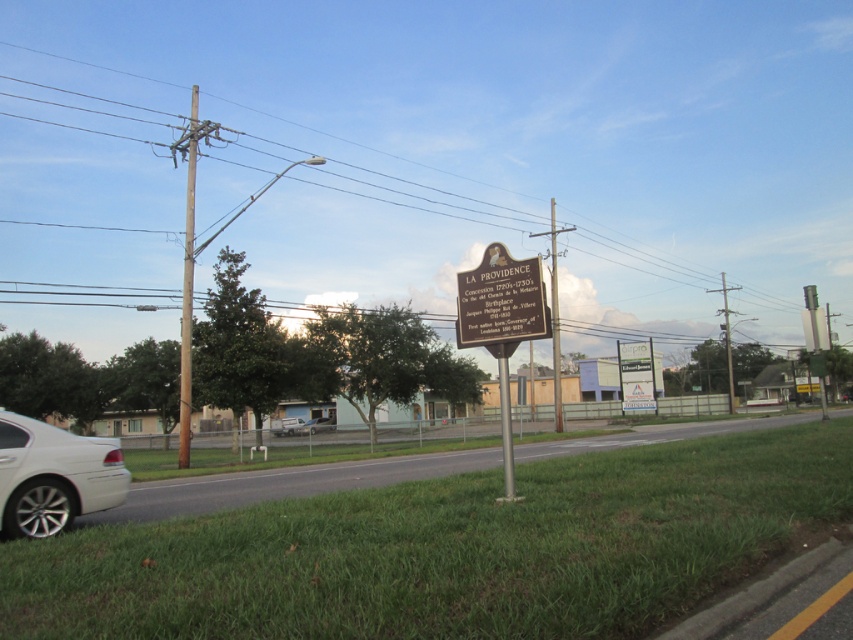
Question: Which object appears farthest from the camera in this image?

Choices:
 (A) metallic pole at center
 (B) metallic wire at upper center
 (C) silver metallic sedan at center

Answer: (C)

Question: Where is metallic wire at upper center located in relation to silver metallic sedan at center in the image?

Choices:
 (A) above
 (B) below

Answer: (A)

Question: Does white metallic car at lower left have a smaller size compared to white plastic sign at center?

Choices:
 (A) no
 (B) yes

Answer: (B)

Question: Estimate the real-world distances between objects in this image. Which object is farther from the silver metallic sedan at center?

Choices:
 (A) white plastic sign at center
 (B) metallic pole at center

Answer: (B)

Question: Among these points, which one is nearest to the camera?

Choices:
 (A) (281, 429)
 (B) (55, 436)
 (C) (554, 305)

Answer: (B)

Question: Is metallic wire at upper center below brown wooden pole at left?

Choices:
 (A) no
 (B) yes

Answer: (A)